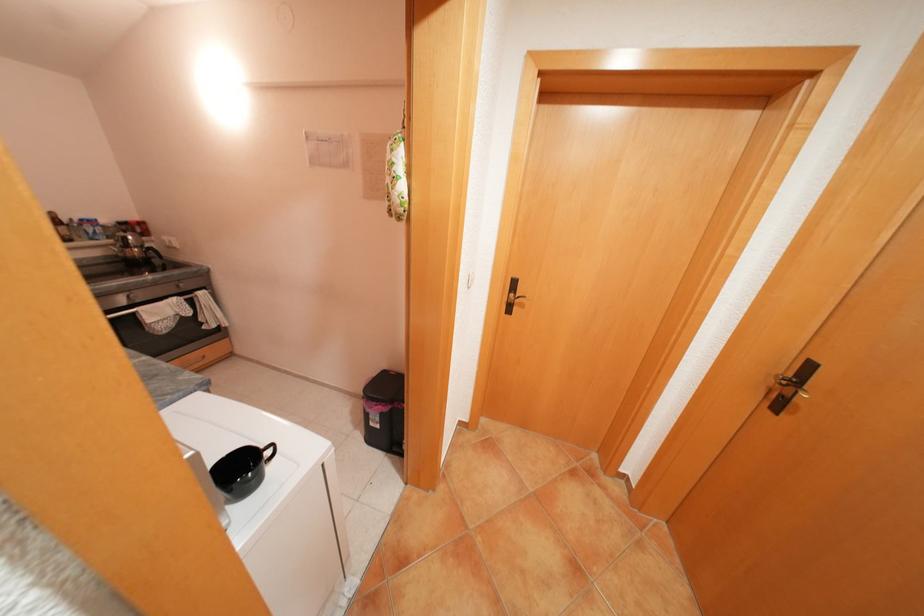
What do you see at coordinates (270, 453) in the screenshot? I see `the black mug handle` at bounding box center [270, 453].